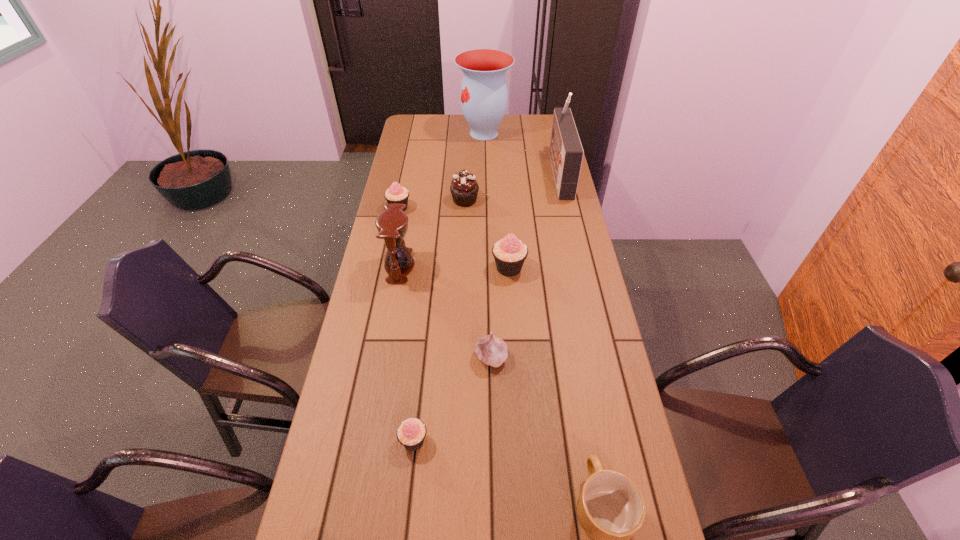
Locate an element on the screen. the third closest object relative to the brown cupcake is located at coordinates (509, 253).

Where is `object that is the closest to the nearest object`? The width and height of the screenshot is (960, 540). object that is the closest to the nearest object is located at coordinates (491, 350).

Point out which cupcake is positioned as the fourth nearest to the mug. Please provide its 2D coordinates. Your answer should be formatted as a tuple, i.e. [(x, y)], where the tuple contains the x and y coordinates of a point satisfying the conditions above.

[(395, 194)]

Point out which cupcake is positioned as the nearest to the brown cupcake. Please provide its 2D coordinates. Your answer should be formatted as a tuple, i.e. [(x, y)], where the tuple contains the x and y coordinates of a point satisfying the conditions above.

[(395, 194)]

Where is `the closest pink cupcake relative to the shortest cupcake`? The image size is (960, 540). the closest pink cupcake relative to the shortest cupcake is located at coordinates (509, 253).

I want to click on pink cupcake that stands as the second closest to the brown hourglass, so click(x=509, y=253).

Find the location of a particular element. This screenshot has width=960, height=540. free location that satisfies the following two spatial constraints: 1. on the back side of the third cupcake from left to right; 2. on the right side of the hourglass is located at coordinates (412, 200).